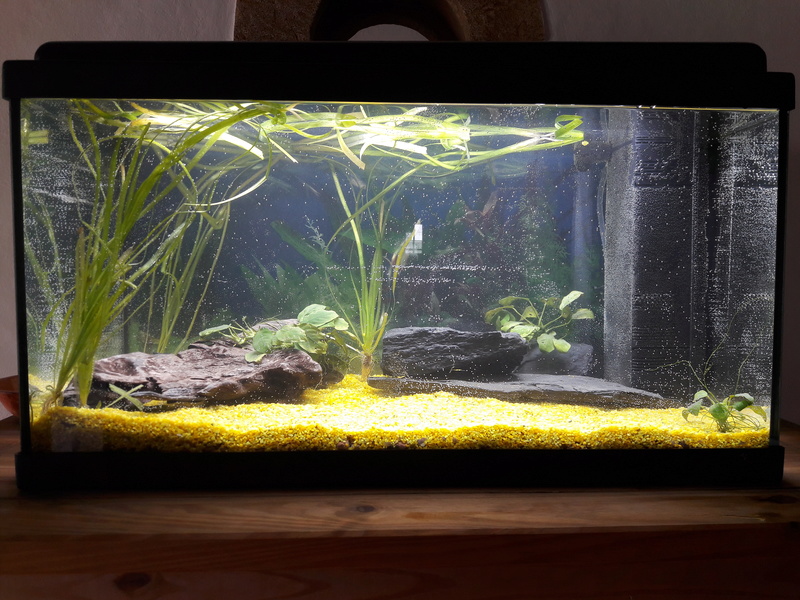
Find the location of `aquarium`. aquarium is located at coordinates [x=508, y=239].